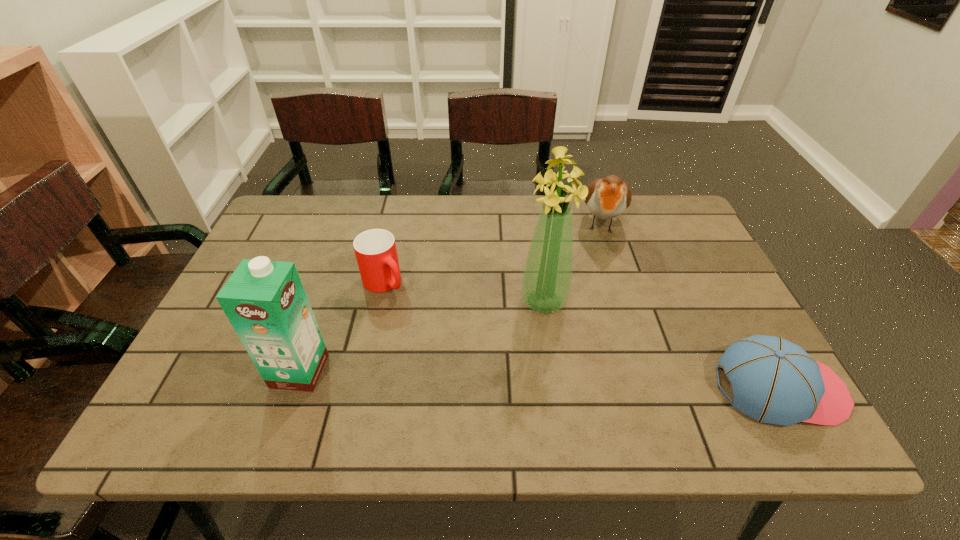
Find the location of a particular element. The image size is (960, 540). free spot between the leftmost object and the bouquet is located at coordinates (421, 336).

Locate an element on the screen. This screenshot has width=960, height=540. free space between the cup and the leftmost object is located at coordinates (342, 326).

I want to click on unoccupied area between the leftmost object and the farthest object, so click(x=450, y=296).

Locate an element on the screen. The width and height of the screenshot is (960, 540). free space between the second object from left to right and the leftmost object is located at coordinates (342, 326).

The image size is (960, 540). What are the coordinates of `unoccupied area between the second object from left to right and the baseball cap` in the screenshot? It's located at (582, 335).

Where is `empty location between the leftmost object and the second object from right to left`? empty location between the leftmost object and the second object from right to left is located at coordinates (450, 296).

Locate an element on the screen. The width and height of the screenshot is (960, 540). object that is the third closest to the third shortest object is located at coordinates (375, 249).

This screenshot has height=540, width=960. In order to click on the fourth closest object relative to the bird in this screenshot , I will do `click(265, 301)`.

Where is `vacant space that satisfies the following two spatial constraints: 1. on the back side of the bird; 2. on the right side of the cup`? vacant space that satisfies the following two spatial constraints: 1. on the back side of the bird; 2. on the right side of the cup is located at coordinates pyautogui.click(x=397, y=222).

I want to click on free space that satisfies the following two spatial constraints: 1. on the front side of the third shortest object; 2. on the front-facing side of the rightmost object, so click(654, 388).